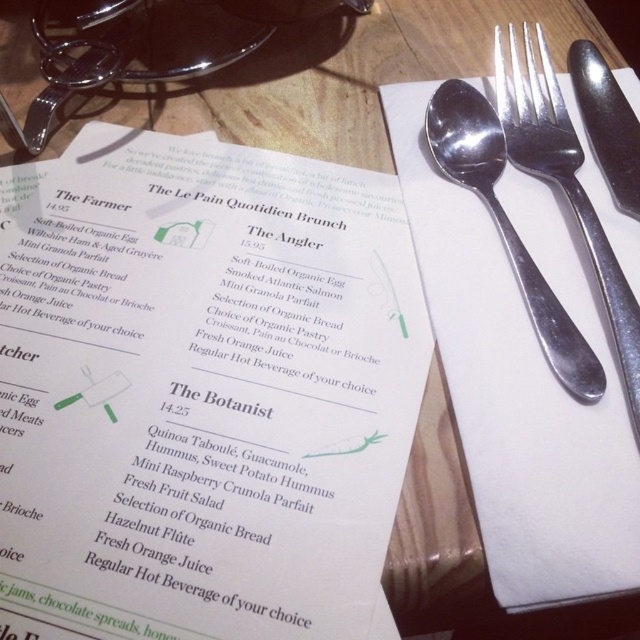
Question: Can you confirm if polished silver fork at upper right is positioned above satin silver spoon at upper right?

Choices:
 (A) yes
 (B) no

Answer: (A)

Question: Which point is closer to the camera?

Choices:
 (A) polished silver fork at upper right
 (B) satin silver spoon at upper right

Answer: (A)

Question: Which of the following is the closest to the observer?

Choices:
 (A) (131, 544)
 (B) (541, 282)
 (C) (561, 148)

Answer: (A)

Question: Which point is closer to the camera taking this photo?

Choices:
 (A) (556, 134)
 (B) (580, 99)

Answer: (A)

Question: From the image, what is the correct spatial relationship of white paper menu at upper left in relation to polished silver fork at upper right?

Choices:
 (A) left
 (B) right

Answer: (A)

Question: Is polished silver fork at upper right smaller than satin silver spoon at upper right?

Choices:
 (A) yes
 (B) no

Answer: (B)